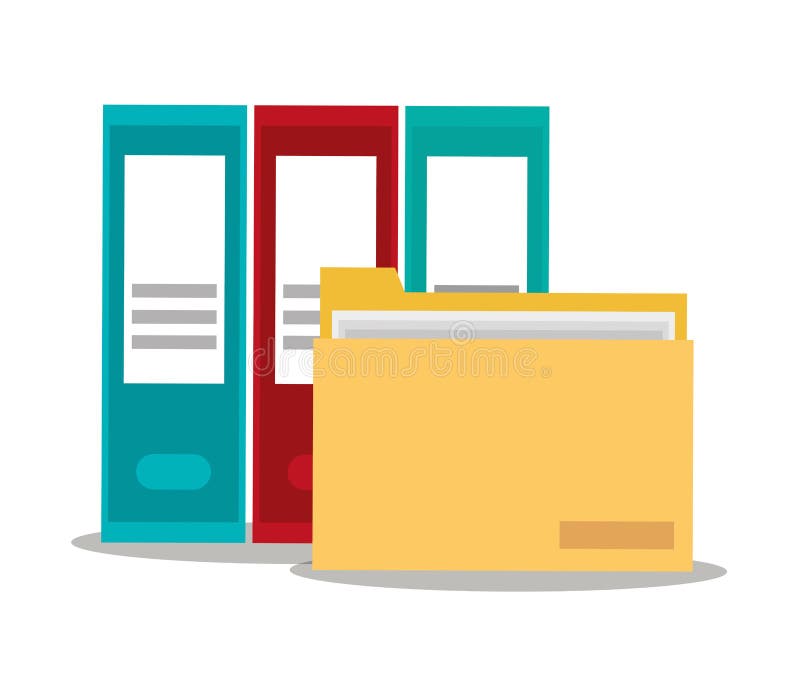
The width and height of the screenshot is (800, 697). What are the coordinates of `white label on red book` in the screenshot? It's located at (321, 222).